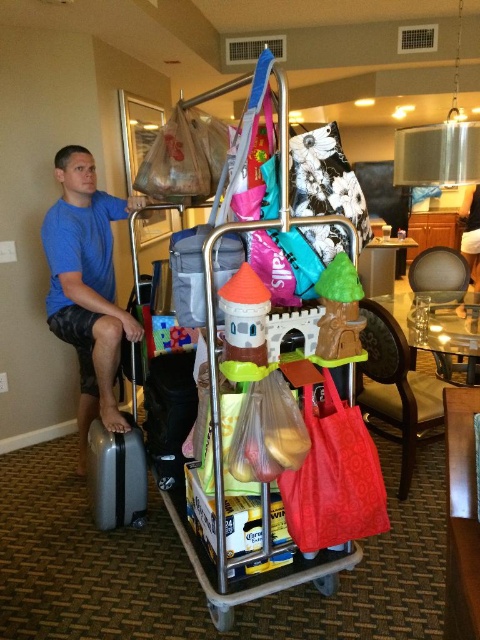
You are packing for a trip and need to decide which item to take based on size. Which of the following is larger in size between the blue cotton shirt at left and the matte plastic suitcase at center?

The blue cotton shirt at left is larger than the matte plastic suitcase at center according to the description.

You are trying to pack your bag and need to know if the blue cotton shirt at left can fit into the silver metallic suitcase at lower left. Based on their sizes, what would you conclude?

The blue cotton shirt at left might be wider than silver metallic suitcase at lower left, so it may not fit inside.

You are a hotel staff member who needs to check if the blue cotton shirt at left and the silver metallic suitcase at lower left are arranged properly according to the hotel policy. The policy states that all clothing items must be placed to the right of any luggage. Are they arranged correctly?

The blue cotton shirt at left is positioned on the left side of the silver metallic suitcase at lower left, which violates the hotel policy requiring clothing items to be placed to the right of luggage. Therefore, they are not arranged correctly.